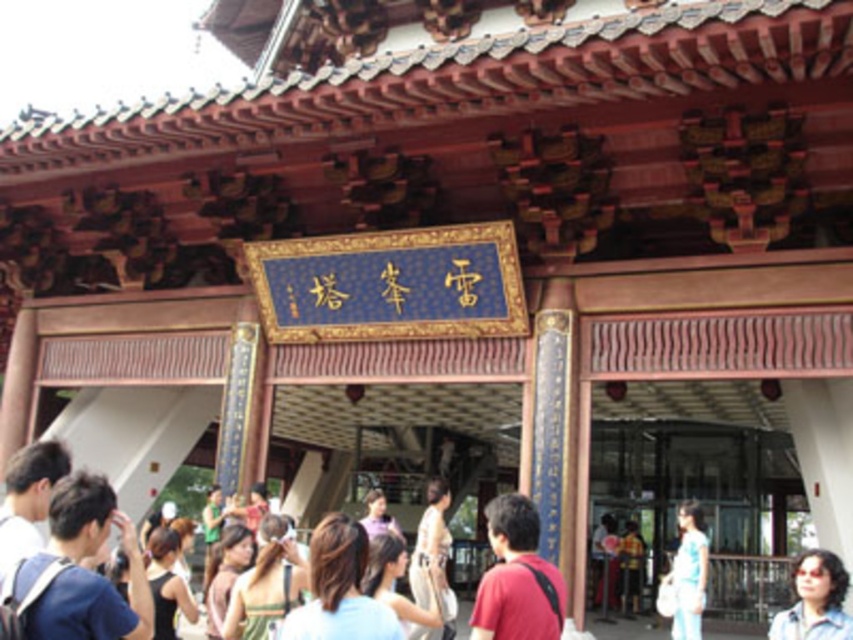
Question: Is light blue fabric at center to the left of matte green dress at center from the viewer's perspective?

Choices:
 (A) yes
 (B) no

Answer: (B)

Question: Can you confirm if matte green dress at center is positioned to the right of matte white shirt at center?

Choices:
 (A) yes
 (B) no

Answer: (B)

Question: Which of the following is the farthest from the observer?

Choices:
 (A) blue fabric backpack at lower left
 (B) matte white shirt at center
 (C) red shirt at center
 (D) silky white dress at center

Answer: (D)

Question: Is the position of red shirt at center more distant than that of silky white dress at center?

Choices:
 (A) yes
 (B) no

Answer: (B)

Question: Estimate the real-world distances between objects in this image. Which object is farther from the blue fabric backpack at lower left?

Choices:
 (A) matte black hair at center
 (B) matte blue shirt at lower right

Answer: (B)

Question: Which point is closer to the camera?

Choices:
 (A) black fabric shirt at lower left
 (B) light blue denim jeans at lower right
 (C) matte black hair at center

Answer: (A)